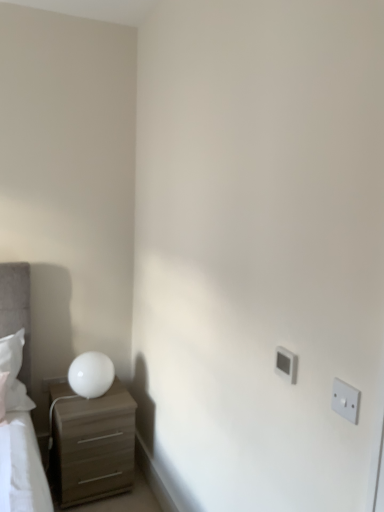
Question: Should I look upward or downward to see matte brown chest of drawers at lower left?

Choices:
 (A) up
 (B) down

Answer: (B)

Question: Does white plastic electric outlet at upper right, the first electric outlet viewed from the left, have a greater width compared to matte brown chest of drawers at lower left?

Choices:
 (A) yes
 (B) no

Answer: (B)

Question: Is white plastic electric outlet at upper right, the first electric outlet viewed from the left, at the left side of matte brown chest of drawers at lower left?

Choices:
 (A) no
 (B) yes

Answer: (A)

Question: Considering the relative sizes of white plastic electric outlet at upper right, the 2th electric outlet in the front-to-back sequence, and matte brown chest of drawers at lower left in the image provided, is white plastic electric outlet at upper right, the 2th electric outlet in the front-to-back sequence, thinner than matte brown chest of drawers at lower left?

Choices:
 (A) yes
 (B) no

Answer: (A)

Question: Does white plastic electric outlet at upper right, the 2th electric outlet in the front-to-back sequence, contain matte brown chest of drawers at lower left?

Choices:
 (A) no
 (B) yes

Answer: (A)

Question: Is white plastic electric outlet at upper right, marked as the 1th electric outlet in a back-to-front arrangement, positioned beyond the bounds of matte brown chest of drawers at lower left?

Choices:
 (A) yes
 (B) no

Answer: (A)

Question: Is white plastic electric outlet at upper right, marked as the 1th electric outlet in a back-to-front arrangement, aimed at matte brown chest of drawers at lower left?

Choices:
 (A) no
 (B) yes

Answer: (A)

Question: Does matte brown chest of drawers at lower left have a smaller size compared to white glossy table lamp at left?

Choices:
 (A) no
 (B) yes

Answer: (A)

Question: From the image's perspective, is matte brown chest of drawers at lower left located beneath white glossy table lamp at left?

Choices:
 (A) yes
 (B) no

Answer: (A)

Question: Is matte brown chest of drawers at lower left directly adjacent to white glossy table lamp at left?

Choices:
 (A) no
 (B) yes

Answer: (A)

Question: Is matte brown chest of drawers at lower left oriented towards white glossy table lamp at left?

Choices:
 (A) yes
 (B) no

Answer: (B)

Question: From the image's perspective, does matte brown chest of drawers at lower left appear higher than white glossy table lamp at left?

Choices:
 (A) no
 (B) yes

Answer: (A)

Question: Is matte brown chest of drawers at lower left turned away from white glossy table lamp at left?

Choices:
 (A) no
 (B) yes

Answer: (A)

Question: Considering the relative positions of white plastic electric outlet at right, the 1th electric outlet when ordered from right to left, and matte brown chest of drawers at lower left in the image provided, is white plastic electric outlet at right, the 1th electric outlet when ordered from right to left, to the left of matte brown chest of drawers at lower left from the viewer's perspective?

Choices:
 (A) yes
 (B) no

Answer: (B)